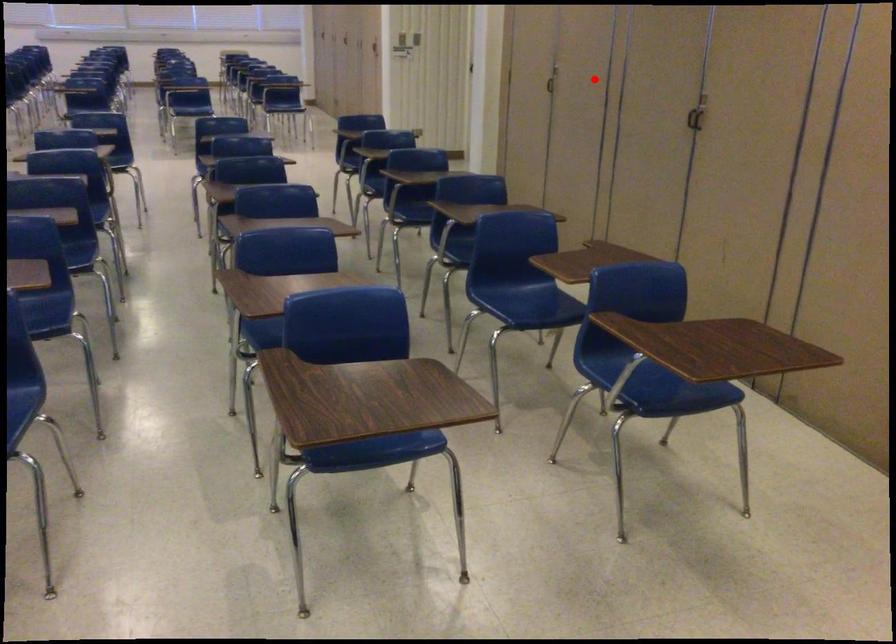
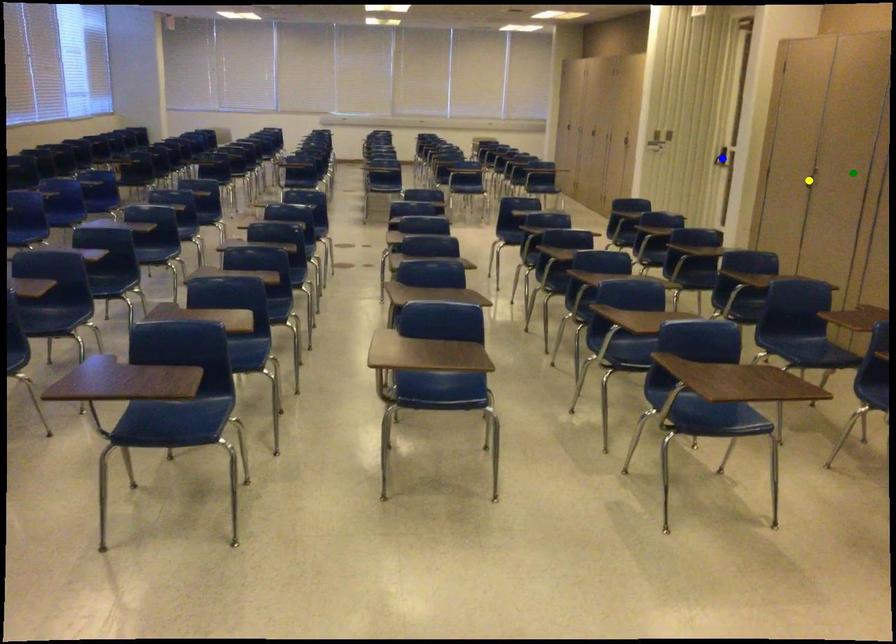
Question: I am providing you with two images of the same scene from different viewpoints. A red point is marked on the first image. You are given multiple points on the second image. In image 2, which mark is for the same physical point as the one in image 1?

Choices:
 (A) blue point
 (B) yellow point
 (C) green point

Answer: (C)